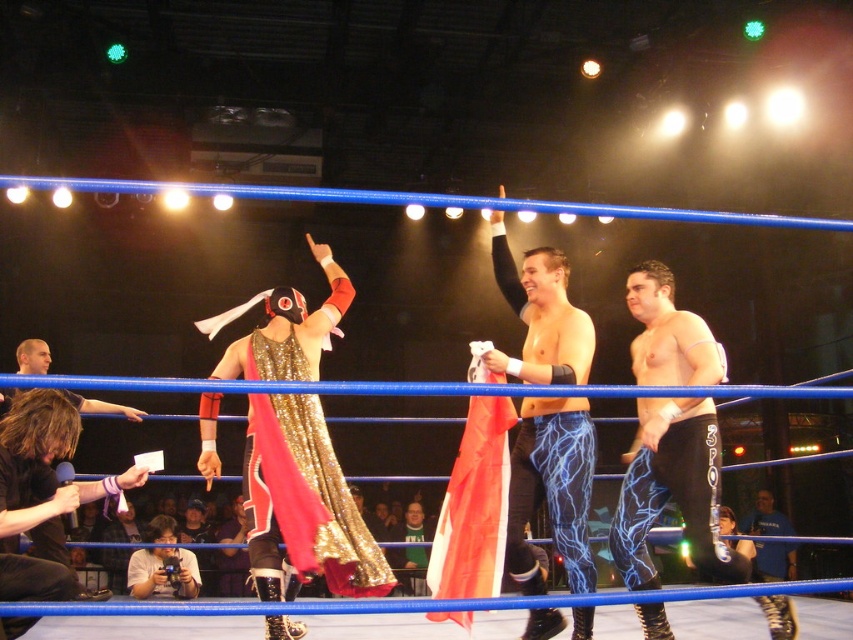
Who is shorter, shiny gold cape at center or matte black camera at lower left?

matte black camera at lower left is shorter.

Can you confirm if shiny gold cape at center is positioned below matte black camera at lower left?

Incorrect, shiny gold cape at center is not positioned below matte black camera at lower left.

Consider the image. Who is more distant from viewer, (273,556) or (135,557)?

The point (135,557) is more distant.

The height and width of the screenshot is (640, 853). Find the location of `shiny gold cape at center`. shiny gold cape at center is located at coordinates point(303,502).

Who is more distant from viewer, (x=627, y=564) or (x=558, y=513)?

Positioned behind is point (x=627, y=564).

Does black spandex pants at center appear on the left side of shiny blue leggings at center?

Incorrect, black spandex pants at center is not on the left side of shiny blue leggings at center.

Image resolution: width=853 pixels, height=640 pixels. Find the location of `black spandex pants at center`. black spandex pants at center is located at coordinates (672, 490).

How far apart are shiny gold cape at center and shiny blue leggings at center?

shiny gold cape at center and shiny blue leggings at center are 33.04 inches apart.

Between point (262, 394) and point (547, 508), which one is positioned in front?

Point (262, 394) is in front.

You are a GUI agent. You are given a task and a screenshot of the screen. Output one action in this format:
    pyautogui.click(x=<x>, y=<y>)
    Task: Click on the shiny gold cape at center
    The height and width of the screenshot is (640, 853).
    Given the screenshot: What is the action you would take?
    pyautogui.click(x=303, y=502)